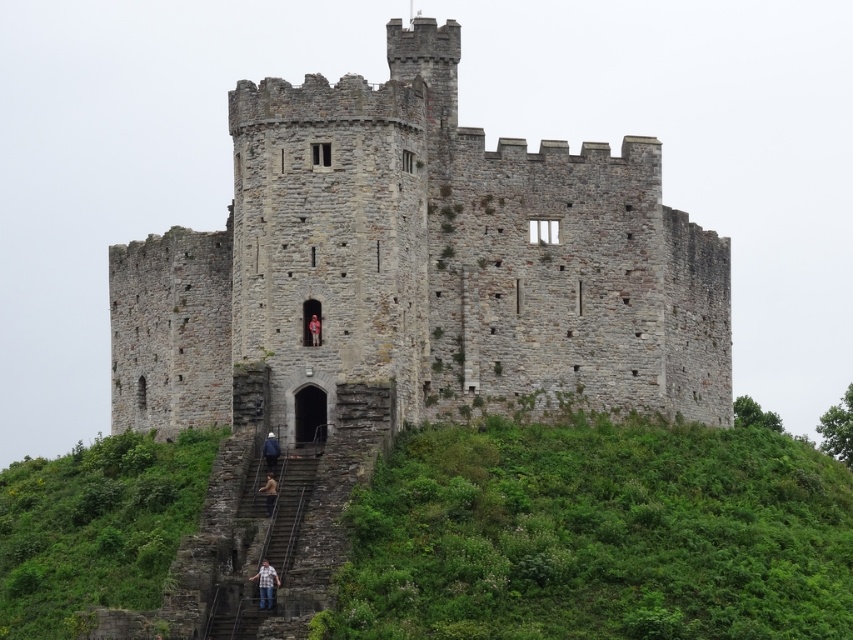
Is the position of gray stone castle at center more distant than that of blue denim jeans at lower center?

Yes.

Does gray stone castle at center have a lesser height compared to blue denim jeans at lower center?

In fact, gray stone castle at center may be taller than blue denim jeans at lower center.

The height and width of the screenshot is (640, 853). What are the coordinates of `gray stone castle at center` in the screenshot? It's located at (421, 266).

Is jeans at lower center to the right of dark blue jeans at lower center from the viewer's perspective?

Yes, jeans at lower center is to the right of dark blue jeans at lower center.

Looking at this image, can you confirm if jeans at lower center is wider than dark blue jeans at lower center?

Yes.

Does point (276, 577) lie behind point (271, 433)?

That is False.

At what (x,y) coordinates should I click in order to perform the action: click on jeans at lower center. Please return your answer as a coordinate pair (x, y). This screenshot has height=640, width=853. Looking at the image, I should click on (265, 582).

Does jeans at lower center appear on the right side of red fabric person at center?

In fact, jeans at lower center is to the left of red fabric person at center.

Is point (279, 582) positioned before point (310, 316)?

Yes, point (279, 582) is closer to viewer.

Where is `jeans at lower center`? The height and width of the screenshot is (640, 853). jeans at lower center is located at coordinates (265, 582).